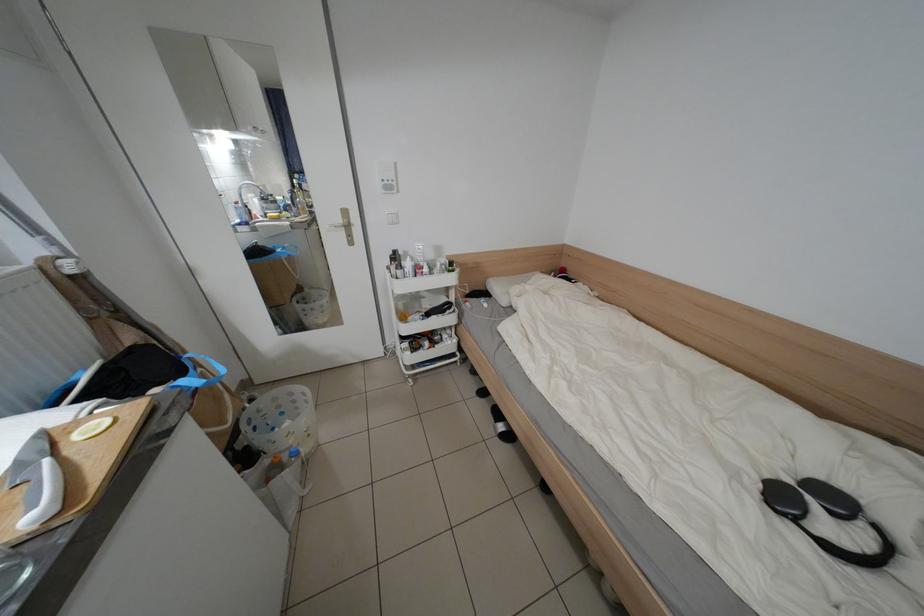
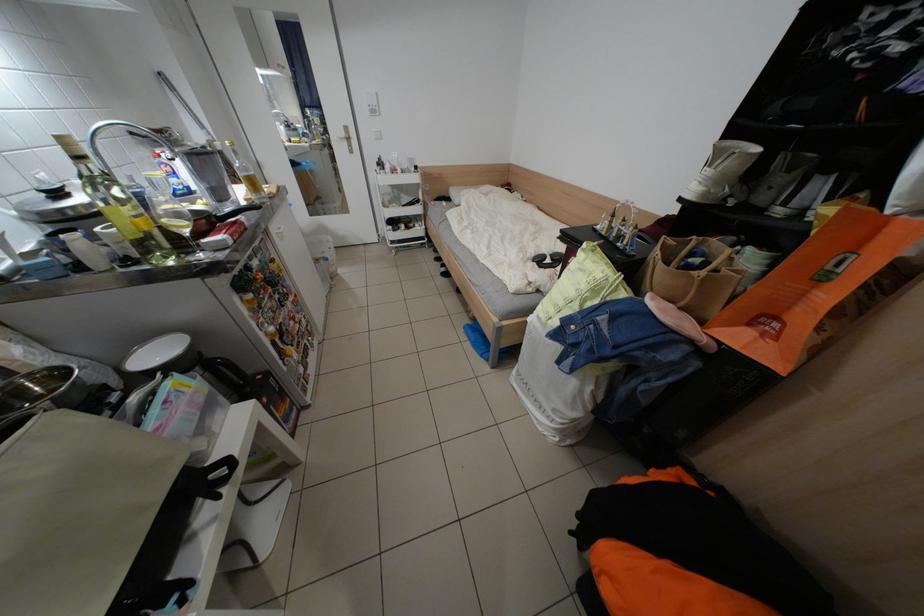
Which direction would the cameraman need to move to produce the second image?

The movement direction of the cameraman is right, backward.